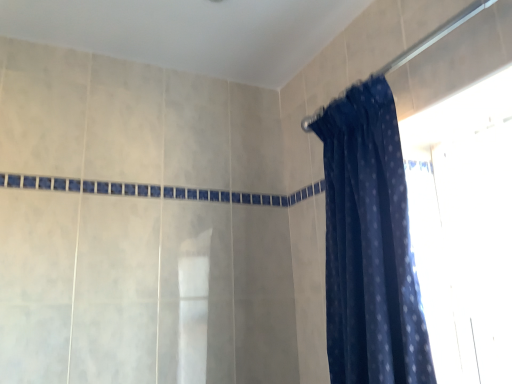
Image resolution: width=512 pixels, height=384 pixels. Describe the element at coordinates (370, 244) in the screenshot. I see `dark blue sheer at upper right` at that location.

The image size is (512, 384). Find the location of `dark blue sheer at upper right`. dark blue sheer at upper right is located at coordinates (370, 244).

At what (x,y) coordinates should I click in order to perform the action: click on dark blue fabric at upper right. Please return your answer as a coordinate pair (x, y). Looking at the image, I should click on (435, 35).

The image size is (512, 384). What do you see at coordinates (435, 35) in the screenshot?
I see `dark blue fabric at upper right` at bounding box center [435, 35].

Find the location of a particular element. dark blue sheer at upper right is located at coordinates (370, 244).

Would you say dark blue fabric at upper right is to the left or to the right of dark blue sheer at upper right in the picture?

Based on their positions, dark blue fabric at upper right is located to the right of dark blue sheer at upper right.

Between dark blue fabric at upper right and dark blue sheer at upper right, which one is positioned in front?

dark blue fabric at upper right is closer to the camera.

Is point (471, 14) positioned in front of point (410, 336)?

No.

From the image's perspective, which object appears higher, dark blue fabric at upper right or dark blue sheer at upper right?

dark blue fabric at upper right is shown above in the image.

From a real-world perspective, is dark blue fabric at upper right below dark blue sheer at upper right?

No.

Which object is wider, dark blue fabric at upper right or dark blue sheer at upper right?

dark blue sheer at upper right.

Is dark blue fabric at upper right taller or shorter than dark blue sheer at upper right?

dark blue fabric at upper right is shorter than dark blue sheer at upper right.

Considering the sizes of objects dark blue fabric at upper right and dark blue sheer at upper right in the image provided, who is smaller, dark blue fabric at upper right or dark blue sheer at upper right?

dark blue fabric at upper right.

Is dark blue sheer at upper right a part of dark blue fabric at upper right?

That's incorrect, dark blue sheer at upper right is not inside dark blue fabric at upper right.

Is dark blue fabric at upper right directly adjacent to dark blue sheer at upper right?

No, dark blue fabric at upper right is not making contact with dark blue sheer at upper right.

Is dark blue fabric at upper right facing away from dark blue sheer at upper right?

No, dark blue fabric at upper right is not facing the opposite direction of dark blue sheer at upper right.

Can you tell me how much dark blue fabric at upper right and dark blue sheer at upper right differ in facing direction?

They differ by 1.08 degrees in their facing directions.

This screenshot has height=384, width=512. I want to click on shower lying on the right of dark blue sheer at upper right, so click(435, 35).

Is dark blue sheer at upper right to the left or to the right of dark blue fabric at upper right in the image?

Based on their positions, dark blue sheer at upper right is located to the left of dark blue fabric at upper right.

Which object is further away from the camera, dark blue sheer at upper right or dark blue fabric at upper right?

Positioned behind is dark blue sheer at upper right.

Considering the positions of points (401, 307) and (444, 31), is point (401, 307) closer to camera compared to point (444, 31)?

Yes, it is.

From the image's perspective, who appears lower, dark blue sheer at upper right or dark blue fabric at upper right?

dark blue sheer at upper right.

From a real-world perspective, which is physically above, dark blue sheer at upper right or dark blue fabric at upper right?

dark blue fabric at upper right, from a real-world perspective.

Considering the sizes of objects dark blue sheer at upper right and dark blue fabric at upper right in the image provided, who is wider, dark blue sheer at upper right or dark blue fabric at upper right?

Wider between the two is dark blue sheer at upper right.

Can you confirm if dark blue sheer at upper right is shorter than dark blue fabric at upper right?

No, dark blue sheer at upper right is not shorter than dark blue fabric at upper right.

From the picture: Does dark blue sheer at upper right have a smaller size compared to dark blue fabric at upper right?

No.

Based on the photo, is dark blue fabric at upper right a part of dark blue sheer at upper right?

No.

Is dark blue sheer at upper right positioned far away from dark blue fabric at upper right?

dark blue sheer at upper right is actually quite close to dark blue fabric at upper right.

Is dark blue sheer at upper right oriented away from dark blue fabric at upper right?

No, dark blue fabric at upper right is not at the back of dark blue sheer at upper right.

Where is `shower in front of the dark blue sheer at upper right`? The image size is (512, 384). shower in front of the dark blue sheer at upper right is located at coordinates (435, 35).

Where is `shower on the right side of dark blue sheer at upper right`? The height and width of the screenshot is (384, 512). shower on the right side of dark blue sheer at upper right is located at coordinates (435, 35).

Find the location of a particular element. The height and width of the screenshot is (384, 512). curtain that appears below the dark blue fabric at upper right (from a real-world perspective) is located at coordinates (370, 244).